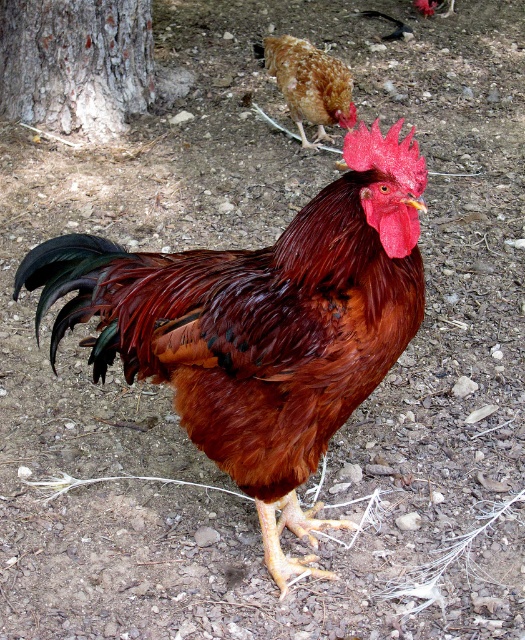
Is shiny brown rooster at center thinner than brown speckled chicken at upper center?

No, shiny brown rooster at center is not thinner than brown speckled chicken at upper center.

Which is in front, point (181, 294) or point (307, 92)?

Point (181, 294)

Is point (349, 300) farther from camera compared to point (296, 67)?

No, it is in front of (296, 67).

I want to click on shiny brown rooster at center, so click(x=261, y=326).

In the scene shown: Is rough bark tree at upper left taller than brown speckled chicken at upper center?

Yes.

Between point (54, 45) and point (348, 102), which one is positioned behind?

The point (54, 45) is behind.

Locate an element on the screen. rough bark tree at upper left is located at coordinates (76, 64).

Between shiny brown rooster at center and rough bark tree at upper left, which one is positioned higher?

rough bark tree at upper left is higher up.

Between point (275, 508) and point (17, 68), which one is positioned behind?

Positioned behind is point (17, 68).

Does point (368, 330) come behind point (106, 42)?

No, (368, 330) is closer to viewer.

Where is `shiny brown rooster at center`? shiny brown rooster at center is located at coordinates (261, 326).